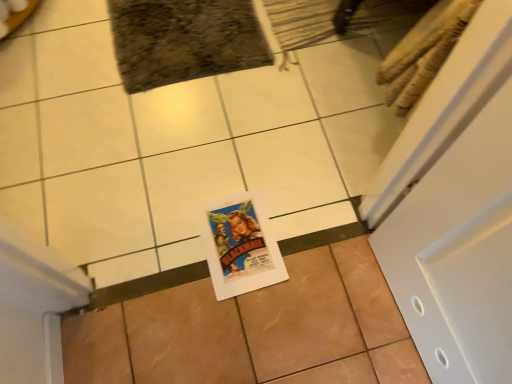
Where is `free point above brown glossy tile at center, placed as the first ceramic tile when sorted from top to bottom (from a real-world perspective)`? free point above brown glossy tile at center, placed as the first ceramic tile when sorted from top to bottom (from a real-world perspective) is located at coordinates (210, 102).